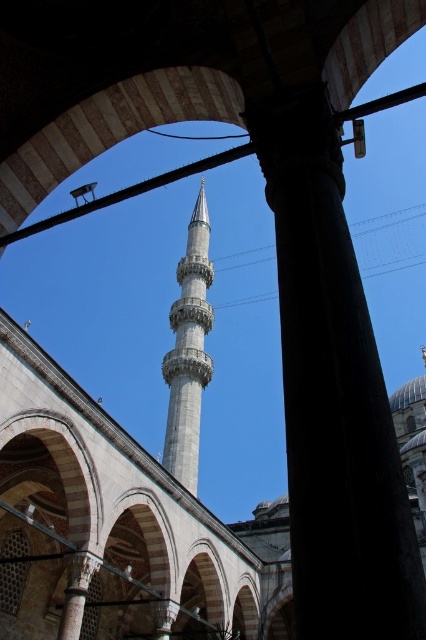
Question: Which point is farther to the camera?

Choices:
 (A) smooth white minaret at center
 (B) smooth stone pillar at center

Answer: (A)

Question: Observing the image, what is the correct spatial positioning of smooth stone pillar at center in reference to smooth white minaret at center?

Choices:
 (A) right
 (B) left

Answer: (A)

Question: Is smooth stone pillar at center smaller than smooth white minaret at center?

Choices:
 (A) yes
 (B) no

Answer: (A)

Question: Where is smooth stone pillar at center located in relation to smooth white minaret at center in the image?

Choices:
 (A) above
 (B) below

Answer: (B)

Question: Among these objects, which one is nearest to the camera?

Choices:
 (A) smooth stone pillar at center
 (B) smooth white minaret at center

Answer: (A)